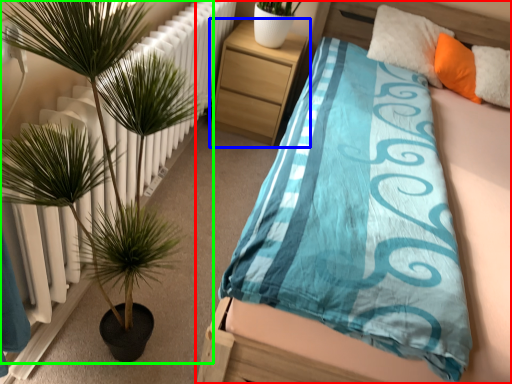
Question: Which object is positioned farthest from bed (highlighted by a red box)? Select from nightstand (highlighted by a blue box) and houseplant (highlighted by a green box).

Choices:
 (A) nightstand
 (B) houseplant

Answer: (A)